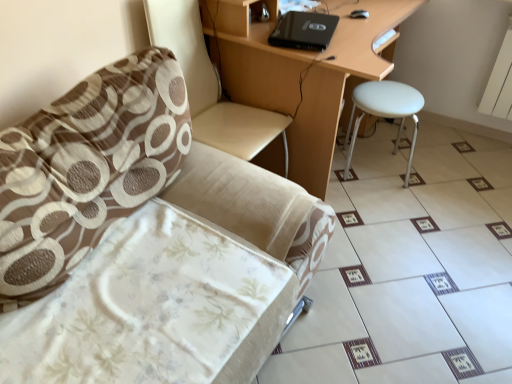
Find the location of a particular element. The width and height of the screenshot is (512, 384). white glossy tile at lower right is located at coordinates (411, 268).

What do you see at coordinates (385, 112) in the screenshot? This screenshot has height=384, width=512. I see `white matte stool at right` at bounding box center [385, 112].

Locate an element on the screen. The image size is (512, 384). brown textured pillow at left is located at coordinates (87, 168).

You are a GUI agent. You are given a task and a screenshot of the screen. Output one action in this format:
    pyautogui.click(x=<x>, y=<y>)
    Task: Click on the matte wood desk at center
    The height and width of the screenshot is (384, 512).
    Given the screenshot: What is the action you would take?
    pyautogui.click(x=300, y=72)

Are beige fabric swivel chair at left and beige fabric chair at left far apart?

No, beige fabric swivel chair at left is not far away from beige fabric chair at left.

Locate an element on the screen. This screenshot has height=384, width=512. swivel chair that is behind the beige fabric chair at left is located at coordinates (210, 85).

Which is closer to the camera, (x=264, y=121) or (x=125, y=307)?

Point (x=264, y=121).

Looking at the image, does beige fabric swivel chair at left seem bigger or smaller compared to beige fabric chair at left?

In the image, beige fabric swivel chair at left appears to be smaller than beige fabric chair at left.

Do you think black matte laptop at upper center is within beige fabric chair at left, or outside of it?

black matte laptop at upper center is not inside beige fabric chair at left, it's outside.

Considering the sizes of objects black matte laptop at upper center and beige fabric chair at left in the image provided, who is wider, black matte laptop at upper center or beige fabric chair at left?

beige fabric chair at left is wider.

Find the location of a particular element. The width and height of the screenshot is (512, 384). laptop that appears on the right of beige fabric chair at left is located at coordinates [x=304, y=31].

From a real-world perspective, who is located higher, black matte laptop at upper center or beige fabric chair at left?

black matte laptop at upper center, from a real-world perspective.

From a real-world perspective, is beige fabric chair at left positioned under brown textured pillow at left based on gravity?

Yes, from a real-world perspective, beige fabric chair at left is beneath brown textured pillow at left.

Visually, is beige fabric chair at left positioned to the left or to the right of brown textured pillow at left?

beige fabric chair at left is to the right of brown textured pillow at left.

Is beige fabric chair at left thinner than brown textured pillow at left?

In fact, beige fabric chair at left might be wider than brown textured pillow at left.

In the scene shown: Is the surface of beige fabric chair at left in direct contact with white glossy tile at lower right?

No, beige fabric chair at left is not making contact with white glossy tile at lower right.

Is beige fabric chair at left oriented away from white glossy tile at lower right?

No, white glossy tile at lower right is not at the back of beige fabric chair at left.

You are a GUI agent. You are given a task and a screenshot of the screen. Output one action in this format:
    pyautogui.click(x=<x>, y=<y>)
    Task: Click on the chair in front of the white glossy tile at lower right
    
    Given the screenshot: What is the action you would take?
    (143, 240)

From the image's perspective, between matte wood desk at center and beige fabric chair at left, which one is located above?

matte wood desk at center, from the image's perspective.

Between matte wood desk at center and beige fabric chair at left, which one is positioned in front?

beige fabric chair at left.

Considering the relative sizes of matte wood desk at center and beige fabric chair at left in the image provided, is matte wood desk at center bigger than beige fabric chair at left?

Indeed, matte wood desk at center has a larger size compared to beige fabric chair at left.

Measure the distance between matte wood desk at center and beige fabric chair at left.

The distance of matte wood desk at center from beige fabric chair at left is 32.18 inches.

Is black matte laptop at upper center inside the boundaries of matte wood desk at center, or outside?

black matte laptop at upper center exists entirely within matte wood desk at center.

From a real-world perspective, is black matte laptop at upper center on matte wood desk at center?

Indeed, from a real-world perspective, black matte laptop at upper center stands above matte wood desk at center.

Is black matte laptop at upper center in front of matte wood desk at center?

No, black matte laptop at upper center is further to the viewer.

Consider the image. Can you see black matte laptop at upper center touching matte wood desk at center?

No, black matte laptop at upper center is not making contact with matte wood desk at center.

Considering the relative sizes of black matte laptop at upper center and white glossy tile at lower right in the image provided, is black matte laptop at upper center smaller than white glossy tile at lower right?

Yes, black matte laptop at upper center is smaller than white glossy tile at lower right.

Between point (294, 38) and point (340, 350), which one is positioned behind?

Positioned behind is point (294, 38).

Image resolution: width=512 pixels, height=384 pixels. Identify the location of laptop above the white glossy tile at lower right (from the image's perspective). (304, 31).

How distant is black matte laptop at upper center from white glossy tile at lower right?

They are 1.28 meters apart.

Identify the location of chair on the left of beige fabric swivel chair at left. The height and width of the screenshot is (384, 512). (143, 240).

The image size is (512, 384). I want to click on laptop located behind the beige fabric chair at left, so click(304, 31).

Considering their positions, is beige fabric chair at left positioned further to matte wood desk at center than beige fabric swivel chair at left?

Among the two, beige fabric chair at left is located further to matte wood desk at center.

Consider the image. Which object lies nearer to the anchor point beige fabric chair at left, white glossy tile at lower right or matte wood desk at center?

white glossy tile at lower right is closer to beige fabric chair at left.

From the picture: Estimate the real-world distances between objects in this image. Which object is further from white matte stool at right, white glossy tile at lower right or beige fabric swivel chair at left?

beige fabric swivel chair at left is positioned further to the anchor white matte stool at right.

From the image, which object appears to be farther from white matte stool at right, beige fabric swivel chair at left or black matte laptop at upper center?

Based on the image, beige fabric swivel chair at left appears to be further to white matte stool at right.

Looking at the image, which one is located further to brown textured pillow at left, black matte laptop at upper center or white matte stool at right?

Among the two, black matte laptop at upper center is located further to brown textured pillow at left.

Considering their positions, is beige fabric chair at left positioned further to beige fabric swivel chair at left than white glossy tile at lower right?

Among the two, white glossy tile at lower right is located further to beige fabric swivel chair at left.

Considering their positions, is brown textured pillow at left positioned closer to black matte laptop at upper center than matte wood desk at center?

matte wood desk at center is positioned closer to the anchor black matte laptop at upper center.

Which object lies further to the anchor point black matte laptop at upper center, matte wood desk at center or beige fabric swivel chair at left?

Among the two, beige fabric swivel chair at left is located further to black matte laptop at upper center.

At what (x,y) coordinates should I click in order to perform the action: click on swivel chair between brown textured pillow at left and black matte laptop at upper center along the z-axis. Please return your answer as a coordinate pair (x, y). Looking at the image, I should click on (210, 85).

Find the location of a particular element. The width and height of the screenshot is (512, 384). desk between beige fabric swivel chair at left and white glossy tile at lower right from left to right is located at coordinates (300, 72).

Find the location of a particular element. The image size is (512, 384). desk situated between brown textured pillow at left and white glossy tile at lower right from left to right is located at coordinates coord(300,72).

You are a GUI agent. You are given a task and a screenshot of the screen. Output one action in this format:
    pyautogui.click(x=<x>, y=<y>)
    Task: Click on the swivel chair situated between brown textured pillow at left and white matte stool at right from left to right
    The image size is (512, 384).
    Given the screenshot: What is the action you would take?
    pyautogui.click(x=210, y=85)